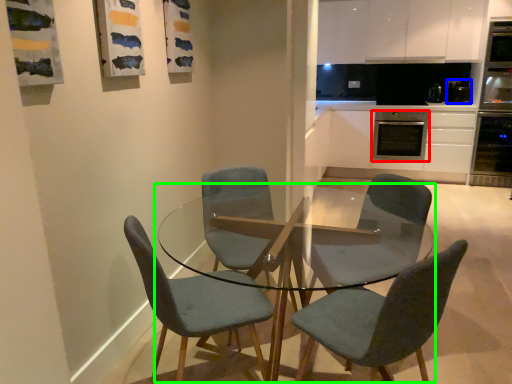
Question: Which object is the farthest from kitchen appliance (highlighted by a red box)? Choose among these: appliance (highlighted by a blue box) or coffee table (highlighted by a green box).

Choices:
 (A) appliance
 (B) coffee table

Answer: (B)